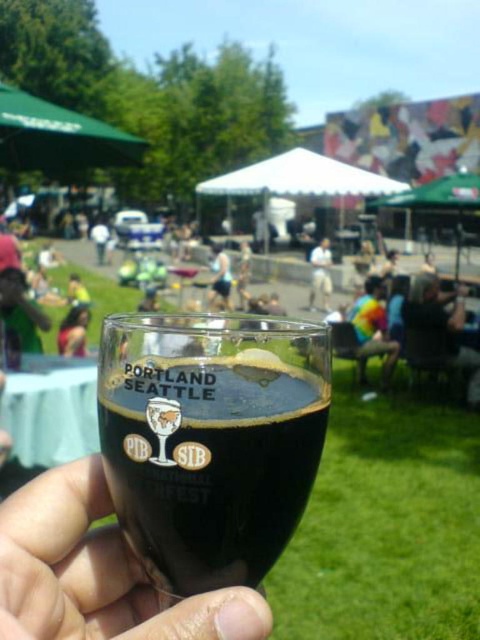
Does transparent plastic glass at center have a greater height compared to white cotton shirt at center?

Correct, transparent plastic glass at center is much taller as white cotton shirt at center.

Where is `transparent plastic glass at center`? This screenshot has width=480, height=640. transparent plastic glass at center is located at coordinates (96, 572).

What do you see at coordinates (96, 572) in the screenshot? This screenshot has width=480, height=640. I see `transparent plastic glass at center` at bounding box center [96, 572].

Identify the location of transparent plastic glass at center. (96, 572).

Does transparent glass at center have a larger size compared to white cotton shirt at center?

Yes, transparent glass at center is bigger than white cotton shirt at center.

Who is taller, transparent glass at center or white cotton shirt at center?

transparent glass at center is taller.

Describe the element at coordinates (211, 440) in the screenshot. The height and width of the screenshot is (640, 480). I see `transparent glass at center` at that location.

Image resolution: width=480 pixels, height=640 pixels. I want to click on transparent glass at center, so click(211, 440).

Is point (204, 449) positioned behind point (154, 604)?

No.

From the picture: Does transparent glass at center have a greater width compared to transparent plastic glass at center?

No, transparent glass at center is not wider than transparent plastic glass at center.

The image size is (480, 640). Identify the location of transparent glass at center. (211, 440).